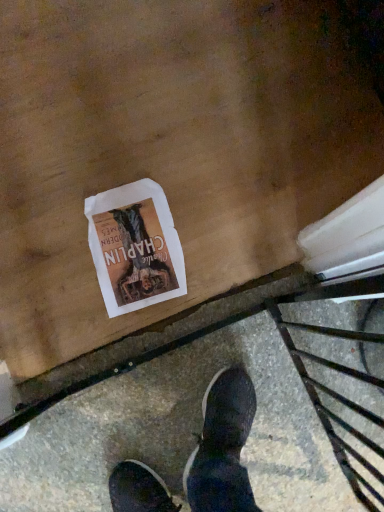
Locate an element on the screen. Image resolution: width=384 pixels, height=512 pixels. vacant location behind white paper flyer at center is located at coordinates (129, 150).